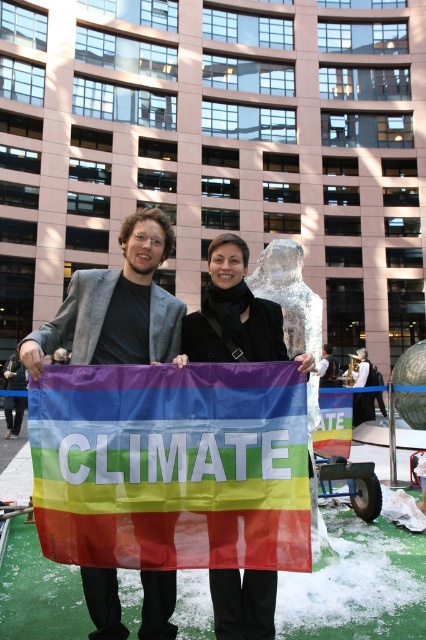
Does black fabric coat at center have a lesser height compared to matte black jacket at center?

No.

Which is above, black fabric coat at center or matte black jacket at center?

matte black jacket at center is higher up.

Is point (235, 582) more distant than point (233, 269)?

No, (235, 582) is closer to viewer.

This screenshot has height=640, width=426. What are the coordinates of `black fabric coat at center` in the screenshot? It's located at (232, 314).

Does point (192, 400) come closer to viewer compared to point (215, 269)?

Yes, point (192, 400) is in front of point (215, 269).

Does point (250, 480) lie in front of point (224, 584)?

Yes.

At what (x,y) coordinates should I click in order to perform the action: click on rainbow fabric flag at center. Please return your answer as a coordinate pair (x, y). Looking at the image, I should click on (172, 465).

Does rainbow fabric flag at center have a lesser width compared to matte black jacket at center?

In fact, rainbow fabric flag at center might be wider than matte black jacket at center.

Does rainbow fabric flag at center appear over matte black jacket at center?

Actually, rainbow fabric flag at center is below matte black jacket at center.

What do you see at coordinates (172, 465) in the screenshot?
I see `rainbow fabric flag at center` at bounding box center [172, 465].

What are the coordinates of `rainbow fabric flag at center` in the screenshot? It's located at (172, 465).